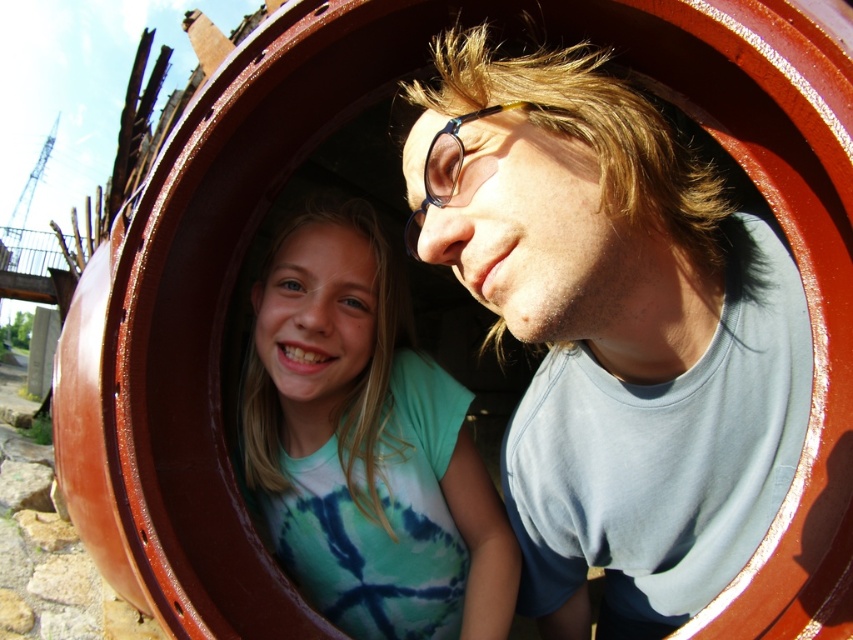
You are standing in front of a large circular opening and see two people peeking through it. One is wearing a tie dye shirt in green and white, and the other is wearing a light gray t shirt. Where exactly is the matte blue shirt at center located?

The matte blue shirt at center is located at point (x=614, y=333).